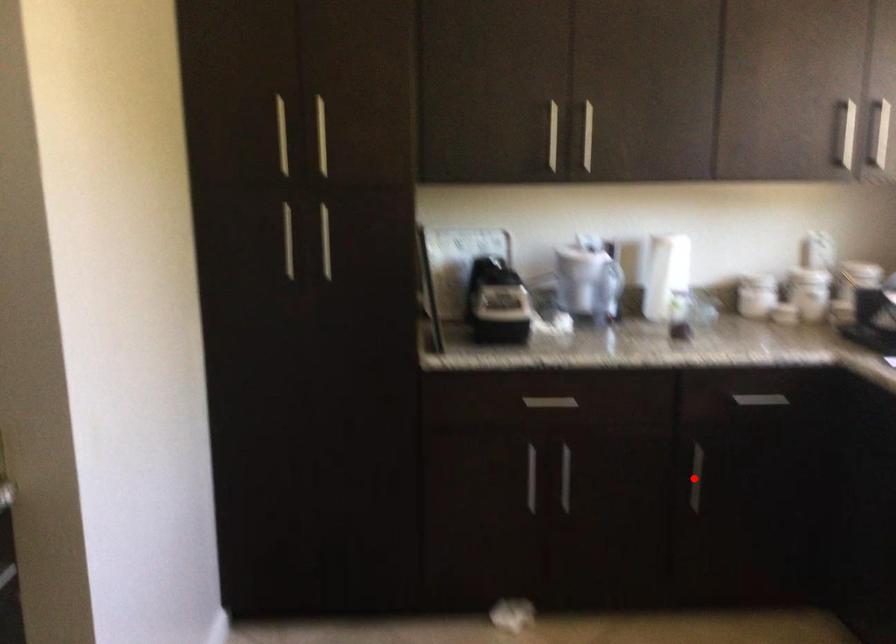
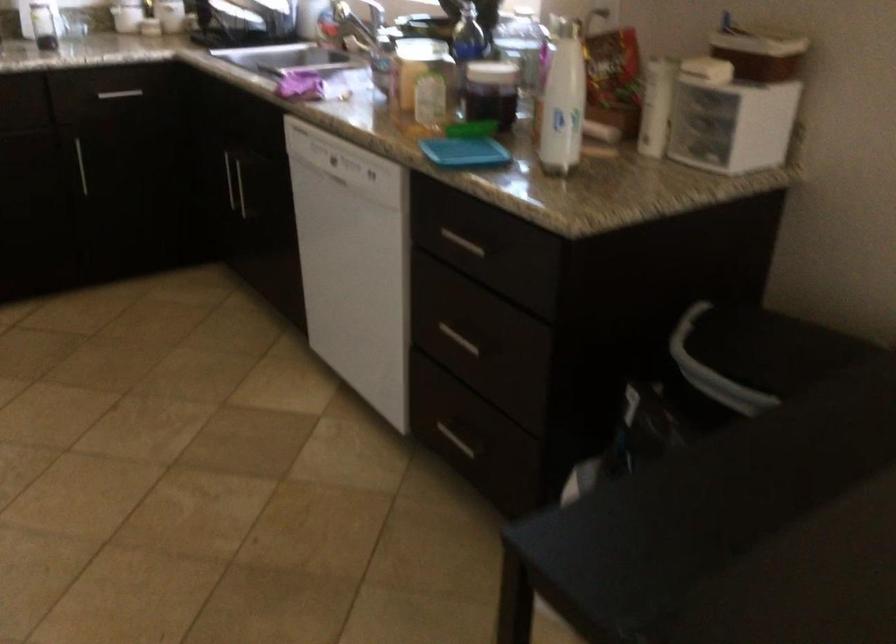
Question: I am providing you with two images of the same scene from different viewpoints. A red point is shown in image1. For the corresponding object point in image2, is it positioned nearer or farther from the camera?

Choices:
 (A) Nearer
 (B) Farther

Answer: (B)